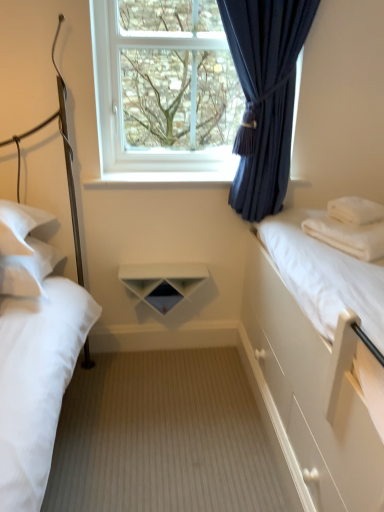
This screenshot has height=512, width=384. What do you see at coordinates (163, 282) in the screenshot? I see `white matte shelf at center` at bounding box center [163, 282].

This screenshot has height=512, width=384. What do you see at coordinates (319, 359) in the screenshot?
I see `white smooth bed at right, which is counted as the 1th bed, starting from the right` at bounding box center [319, 359].

Locate an element on the screen. white soft pillow at right, the 3th pillow when ordered from left to right is located at coordinates (355, 210).

I want to click on wooden floor at center, so click(162, 437).

In order to face white soft pillow at right, the 2th pillow when ordered from left to right, should I rotate leftwards or rightwards?

To face it directly, rotate right by 21.647 degrees.

Measure the distance between point (311, 231) and camera.

Point (311, 231) is 1.73 meters from camera.

Find the location of a particular element. This screenshot has height=512, width=384. white matte bed at left, which appears as the 1th bed when viewed from the left is located at coordinates (35, 346).

From the image's perspective, does white soft pillow at left, acting as the 3th pillow starting from the right, appear lower than white glossy shelf at center?

Yes, from the image's perspective, white soft pillow at left, acting as the 3th pillow starting from the right, is below white glossy shelf at center.

Between white soft pillow at left, which ranks as the first pillow in left-to-right order, and white glossy shelf at center, which one appears on the right side from the viewer's perspective?

white glossy shelf at center.

Is the depth of white soft pillow at left, acting as the 3th pillow starting from the right, less than that of white glossy shelf at center?

Yes, it is.

At what (x,y) coordinates should I click in order to perform the action: click on shelf located underneath the white soft pillow at right, the 1th pillow in the right-to-left sequence (from a real-world perspective). Please return your answer as a coordinate pair (x, y). Image resolution: width=384 pixels, height=512 pixels. Looking at the image, I should click on (163, 282).

Based on the photo, which object is further away from the camera, white matte shelf at center or white soft pillow at right, the 1th pillow in the right-to-left sequence?

white matte shelf at center is behind.

Which is more distant, (143, 290) or (330, 207)?

The point (143, 290) is behind.

From the image's perspective, is white matte shelf at center located above white soft pillow at right, the 3th pillow when ordered from left to right?

No, from the image's perspective, white matte shelf at center is not over white soft pillow at right, the 3th pillow when ordered from left to right.

Is white matte bed at left, which appears as the 1th bed when viewed from the left, a part of white soft pillow at left, which ranks as the first pillow in left-to-right order?

No, white soft pillow at left, which ranks as the first pillow in left-to-right order, does not contain white matte bed at left, which appears as the 1th bed when viewed from the left.

Between white soft pillow at left, which ranks as the first pillow in left-to-right order, and white matte bed at left, which appears as the 1th bed when viewed from the left, which one has larger size?

With larger size is white matte bed at left, which appears as the 1th bed when viewed from the left.

From a real-world perspective, is white soft pillow at left, which ranks as the first pillow in left-to-right order, above or below white matte bed at left, which is the second bed in right-to-left order?

Clearly, from a real-world perspective, white soft pillow at left, which ranks as the first pillow in left-to-right order, is below white matte bed at left, which is the second bed in right-to-left order.

In terms of width, does white soft pillow at left, acting as the 3th pillow starting from the right, look wider or thinner when compared to white matte bed at left, which is the second bed in right-to-left order?

Considering their sizes, white soft pillow at left, acting as the 3th pillow starting from the right, looks slimmer than white matte bed at left, which is the second bed in right-to-left order.

Is there a large distance between white glossy shelf at center and white smooth bed at right, which is counted as the 1th bed, starting from the right?

No, white glossy shelf at center is not far from white smooth bed at right, which is counted as the 1th bed, starting from the right.

How different are the orientations of white glossy shelf at center and white smooth bed at right, the second bed when ordered from left to right, in degrees?

The angular difference between white glossy shelf at center and white smooth bed at right, the second bed when ordered from left to right, is 89.7 degrees.

From a real-world perspective, is white glossy shelf at center above or below white smooth bed at right, the second bed when ordered from left to right?

In terms of real-world spatial position, white glossy shelf at center is above white smooth bed at right, the second bed when ordered from left to right.

Considering the positions of point (219, 170) and point (265, 364), is point (219, 170) closer or farther from the camera than point (265, 364)?

Point (219, 170).

From a real-world perspective, which is physically below, wooden floor at center or dark blue fabric at upper center?

wooden floor at center, from a real-world perspective.

What's the angular difference between wooden floor at center and dark blue fabric at upper center's facing directions?

The angle between the facing direction of wooden floor at center and the facing direction of dark blue fabric at upper center is 1.36 degrees.

Considering the relative positions of wooden floor at center and dark blue fabric at upper center in the image provided, is wooden floor at center to the right of dark blue fabric at upper center from the viewer's perspective?

Incorrect, wooden floor at center is not on the right side of dark blue fabric at upper center.

Would you say wooden floor at center is outside dark blue fabric at upper center?

Indeed, wooden floor at center is completely outside dark blue fabric at upper center.

Is white soft pillow at right, marked as the second pillow in a right-to-left arrangement, positioned behind transparent glass window at upper center?

No, white soft pillow at right, marked as the second pillow in a right-to-left arrangement, is closer to the viewer.

From the image's perspective, is white soft pillow at right, the 2th pillow when ordered from left to right, located beneath transparent glass window at upper center?

Yes.

What's the angular difference between white soft pillow at right, marked as the second pillow in a right-to-left arrangement, and transparent glass window at upper center's facing directions?

The angular difference between white soft pillow at right, marked as the second pillow in a right-to-left arrangement, and transparent glass window at upper center is 27.5 degrees.

Does white matte bed at left, which appears as the 1th bed when viewed from the left, have a smaller size compared to white soft pillow at left, which ranks as the first pillow in left-to-right order?

No, white matte bed at left, which appears as the 1th bed when viewed from the left, is not smaller than white soft pillow at left, which ranks as the first pillow in left-to-right order.

Is white matte bed at left, which appears as the 1th bed when viewed from the left, thinner than white soft pillow at left, which ranks as the first pillow in left-to-right order?

Incorrect, the width of white matte bed at left, which appears as the 1th bed when viewed from the left, is not less than that of white soft pillow at left, which ranks as the first pillow in left-to-right order.

From a real-world perspective, is white matte bed at left, which appears as the 1th bed when viewed from the left, located beneath white soft pillow at left, which ranks as the first pillow in left-to-right order?

No.

Locate an element on the screen. window sill that appears above the white soft pillow at left, acting as the 3th pillow starting from the right (from the image's perspective) is located at coordinates 161,179.

Find the location of `the 3rd pillow positioned above the white matte shelf at center (from a real-world perspective)`. the 3rd pillow positioned above the white matte shelf at center (from a real-world perspective) is located at coordinates (355, 210).

From the image, which object appears to be nearer to transparent glass window at upper center, white matte shelf at center or white soft pillow at right, the 3th pillow when ordered from left to right?

white matte shelf at center is closer to transparent glass window at upper center.

When comparing their distances from white matte shelf at center, does white soft pillow at right, the 1th pillow in the right-to-left sequence, or wooden floor at center seem closer?

Among the two, wooden floor at center is located nearer to white matte shelf at center.

Estimate the real-world distances between objects in this image. Which object is closer to white soft pillow at left, acting as the 3th pillow starting from the right, white soft pillow at right, marked as the second pillow in a right-to-left arrangement, or dark blue fabric at upper center?

dark blue fabric at upper center.

Considering their positions, is white glossy shelf at center positioned closer to white soft pillow at left, which ranks as the first pillow in left-to-right order, than wooden floor at center?

The object closer to white soft pillow at left, which ranks as the first pillow in left-to-right order, is white glossy shelf at center.

Considering their positions, is dark blue fabric at upper center positioned closer to white matte bed at left, which appears as the 1th bed when viewed from the left, than transparent glass window at upper center?

transparent glass window at upper center lies closer to white matte bed at left, which appears as the 1th bed when viewed from the left, than the other object.

Based on their spatial positions, is white soft pillow at right, the 1th pillow in the right-to-left sequence, or white soft pillow at right, the 2th pillow when ordered from left to right, closer to transparent glass window at upper center?

white soft pillow at right, the 1th pillow in the right-to-left sequence, is closer to transparent glass window at upper center.

Based on their spatial positions, is white soft pillow at right, the 1th pillow in the right-to-left sequence, or white matte shelf at center closer to white glossy shelf at center?

Based on the image, white matte shelf at center appears to be nearer to white glossy shelf at center.

Considering their positions, is white smooth bed at right, which is counted as the 1th bed, starting from the right, positioned further to white soft pillow at left, which ranks as the first pillow in left-to-right order, than wooden floor at center?

white smooth bed at right, which is counted as the 1th bed, starting from the right.

Image resolution: width=384 pixels, height=512 pixels. I want to click on window sill between white soft pillow at left, acting as the 3th pillow starting from the right, and dark blue fabric at upper center, in the horizontal direction, so click(161, 179).

This screenshot has height=512, width=384. Find the location of `window sill between transparent glass window at upper center and white soft pillow at right, the 3th pillow when ordered from left to right`. window sill between transparent glass window at upper center and white soft pillow at right, the 3th pillow when ordered from left to right is located at coordinates (161, 179).

I want to click on plain between white matte bed at left, which is the second bed in right-to-left order, and white smooth bed at right, the second bed when ordered from left to right, in the horizontal direction, so pyautogui.click(x=162, y=437).

Locate an element on the screen. curtain between white soft pillow at left, acting as the 3th pillow starting from the right, and white soft pillow at right, the 2th pillow when ordered from left to right, from left to right is located at coordinates (265, 96).